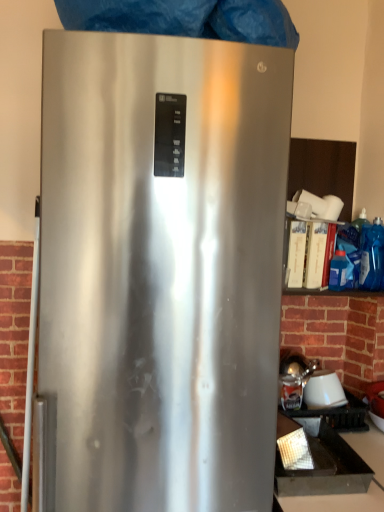
What do you see at coordinates (14, 335) in the screenshot?
I see `brickwork at left` at bounding box center [14, 335].

What is the approximate width of brickwork at left?

brickwork at left is 19.29 centimeters wide.

Measure the distance between point (314, 374) and camera.

A distance of 5.46 feet exists between point (314, 374) and camera.

What do you see at coordinates (304, 289) in the screenshot? This screenshot has width=384, height=512. I see `blue plastic bag at right` at bounding box center [304, 289].

You are a GUI agent. You are given a task and a screenshot of the screen. Output one action in this format:
    pyautogui.click(x=<x>, y=<y>)
    Task: Click on the black matte tray at lower right
    The width and height of the screenshot is (384, 512).
    Given the screenshot: What is the action you would take?
    pyautogui.click(x=337, y=501)

Looking at this image, is satin silver refrigerator at center oriented towards white glossy lampshade at lower right?

No, satin silver refrigerator at center is not oriented towards white glossy lampshade at lower right.

Is satin silver refrigerator at center bigger or smaller than white glossy lampshade at lower right?

Considering their sizes, satin silver refrigerator at center takes up more space than white glossy lampshade at lower right.

In the image, is satin silver refrigerator at center on the left side or the right side of white glossy lampshade at lower right?

satin silver refrigerator at center is to the left of white glossy lampshade at lower right.

This screenshot has width=384, height=512. I want to click on refrigerator on the left of white glossy lampshade at lower right, so click(x=161, y=272).

Consider the image. Is black matte tray at lower right positioned with its back to white glossy lampshade at lower right?

black matte tray at lower right does not have its back to white glossy lampshade at lower right.

Would you say black matte tray at lower right is a long distance from white glossy lampshade at lower right?

No, black matte tray at lower right is not far from white glossy lampshade at lower right.

From the image's perspective, is black matte tray at lower right on white glossy lampshade at lower right?

Incorrect, from the image's perspective, black matte tray at lower right is lower than white glossy lampshade at lower right.

From a real-world perspective, who is located higher, black matte tray at lower right or white glossy lampshade at lower right?

From a 3D spatial view, white glossy lampshade at lower right is above.

From a real-world perspective, is white glossy lampshade at lower right on top of blue plastic bag at right?

Incorrect, from a real-world perspective, white glossy lampshade at lower right is lower than blue plastic bag at right.

Which of these two, white glossy lampshade at lower right or blue plastic bag at right, stands shorter?

Standing shorter between the two is white glossy lampshade at lower right.

From the image's perspective, is white glossy lampshade at lower right located above blue plastic bag at right?

Actually, white glossy lampshade at lower right appears below blue plastic bag at right in the image.

Considering the relative sizes of white glossy lampshade at lower right and blue plastic bag at right in the image provided, is white glossy lampshade at lower right smaller than blue plastic bag at right?

Correct, white glossy lampshade at lower right occupies less space than blue plastic bag at right.

Can you tell me how much blue plastic bag at right and black matte tray at lower right differ in facing direction?

The facing directions of blue plastic bag at right and black matte tray at lower right are 14 degrees apart.

Can you confirm if blue plastic bag at right is positioned to the right of black matte tray at lower right?

Yes.

Could you tell me if blue plastic bag at right is facing black matte tray at lower right?

No, blue plastic bag at right is not facing towards black matte tray at lower right.

Who is more distant, blue plastic bag at right or black matte tray at lower right?

Positioned behind is blue plastic bag at right.

Does white glossy lampshade at lower right have a smaller size compared to satin silver refrigerator at center?

Indeed, white glossy lampshade at lower right has a smaller size compared to satin silver refrigerator at center.

Considering the relative sizes of white glossy lampshade at lower right and satin silver refrigerator at center in the image provided, is white glossy lampshade at lower right thinner than satin silver refrigerator at center?

Yes, white glossy lampshade at lower right is thinner than satin silver refrigerator at center.

The width and height of the screenshot is (384, 512). What are the coordinates of `refrigerator on the left of white glossy lampshade at lower right` in the screenshot? It's located at (161, 272).

Is point (325, 391) in front of point (261, 215)?

No, it is behind (261, 215).

Is brickwork at left taller than black matte tray at lower right?

Yes, brickwork at left is taller than black matte tray at lower right.

From the image's perspective, which object appears higher, brickwork at left or black matte tray at lower right?

From the image's view, brickwork at left is above.

Is brickwork at left wider or thinner than black matte tray at lower right?

brickwork at left is thinner than black matte tray at lower right.

Based on the photo, is black matte tray at lower right smaller than brickwork at left?

Actually, black matte tray at lower right might be larger than brickwork at left.

Is black matte tray at lower right next to brickwork at left?

No, black matte tray at lower right is not with brickwork at left.

Can you tell me how much black matte tray at lower right and brickwork at left differ in facing direction?

The angular difference between black matte tray at lower right and brickwork at left is 1.67 degrees.

Find the location of `refrigerator lying above the white glossy lampshade at lower right (from the image's perspective)`. refrigerator lying above the white glossy lampshade at lower right (from the image's perspective) is located at coordinates (161, 272).

This screenshot has height=512, width=384. Find the location of `counter top below the white glossy lampshade at lower right (from a real-world perspective)`. counter top below the white glossy lampshade at lower right (from a real-world perspective) is located at coordinates (337, 501).

Considering their positions, is satin silver refrigerator at center positioned closer to white glossy lampshade at lower right than brickwork at left?

satin silver refrigerator at center.

From the image, which object appears to be nearer to black matte tray at lower right, white glossy lampshade at lower right or brickwork at left?

white glossy lampshade at lower right.

From the image, which object appears to be farther from blue plastic bag at right, black matte tray at lower right or brickwork at left?

Based on the image, brickwork at left appears to be further to blue plastic bag at right.

When comparing their distances from brickwork at left, does white glossy lampshade at lower right or blue plastic bag at right seem closer?

blue plastic bag at right lies closer to brickwork at left than the other object.

From the image, which object appears to be nearer to blue plastic bag at right, brickwork at left or black matte tray at lower right?

The object closer to blue plastic bag at right is black matte tray at lower right.

From the image, which object appears to be farther from brickwork at left, black matte tray at lower right or blue plastic bag at right?

black matte tray at lower right.

Which object lies further to the anchor point brickwork at left, blue plastic bag at right or white glossy lampshade at lower right?

white glossy lampshade at lower right is positioned further to the anchor brickwork at left.

Which object lies further to the anchor point blue plastic bag at right, satin silver refrigerator at center or brickwork at left?

Based on the image, brickwork at left appears to be further to blue plastic bag at right.

At what (x,y) coordinates should I click in order to perform the action: click on counter top between satin silver refrigerator at center and white glossy lampshade at lower right from front to back. Please return your answer as a coordinate pair (x, y). The image size is (384, 512). Looking at the image, I should click on (337, 501).

You are a GUI agent. You are given a task and a screenshot of the screen. Output one action in this format:
    pyautogui.click(x=<x>, y=<y>)
    Task: Click on the refrigerator between brickwork at left and black matte tray at lower right from left to right
    
    Given the screenshot: What is the action you would take?
    pyautogui.click(x=161, y=272)

Where is `refrigerator between blue plastic bag at right and black matte tray at lower right in the vertical direction`? refrigerator between blue plastic bag at right and black matte tray at lower right in the vertical direction is located at coordinates (161, 272).

In order to click on counter top between brickwork at left and white glossy lampshade at lower right from left to right in this screenshot , I will do `click(337, 501)`.